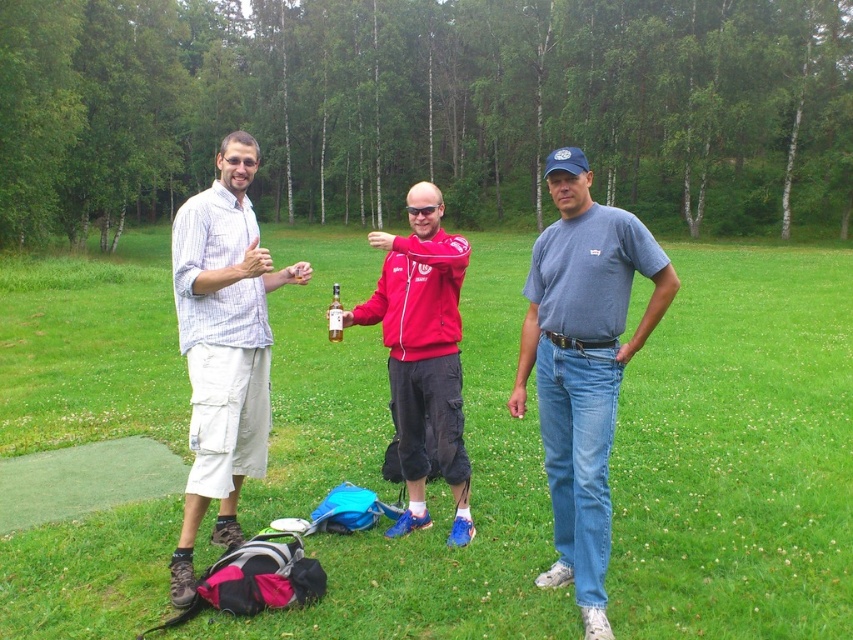
Question: Which point appears closest to the camera in this image?

Choices:
 (A) (637, 572)
 (B) (405, 413)

Answer: (A)

Question: Can you confirm if green grass at center is positioned above denim jeans at center?

Choices:
 (A) no
 (B) yes

Answer: (B)

Question: Which point is farther to the camera?

Choices:
 (A) denim jeans at center
 (B) green grass at center
 (C) striped cotton shirt at left

Answer: (C)

Question: Is green grass at center smaller than matte red jacket at center?

Choices:
 (A) no
 (B) yes

Answer: (A)

Question: Estimate the real-world distances between objects in this image. Which object is closer to the denim jeans at center?

Choices:
 (A) striped cotton shirt at left
 (B) green grass at center
 (C) matte red jacket at center

Answer: (C)

Question: Is striped cotton shirt at left closer to the viewer compared to matte red jacket at center?

Choices:
 (A) yes
 (B) no

Answer: (A)